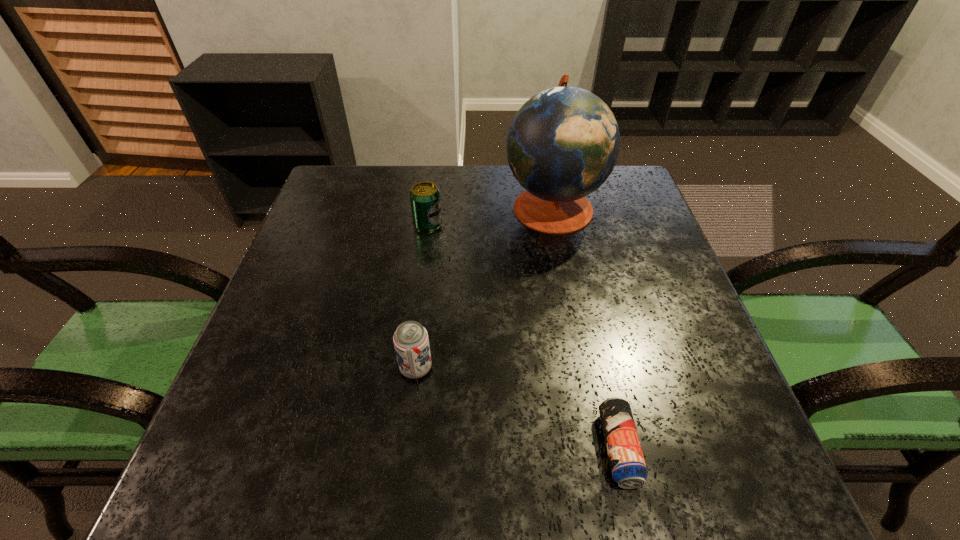
At what (x,y) coordinates should I click in order to perform the action: click on the tallest object. Please return your answer as a coordinate pair (x, y). Looking at the image, I should click on (563, 143).

Image resolution: width=960 pixels, height=540 pixels. Find the location of `the farthest beer can`. the farthest beer can is located at coordinates (425, 200).

At what (x,y) coordinates should I click in order to perform the action: click on the second nearest beer can. Please return your answer as a coordinate pair (x, y). The height and width of the screenshot is (540, 960). Looking at the image, I should click on (411, 342).

Locate an element on the screen. the shortest object is located at coordinates (627, 463).

Identify the location of the shortest beer can. This screenshot has height=540, width=960. (627, 463).

Image resolution: width=960 pixels, height=540 pixels. In order to click on vacant space located 0.360m with the Americas facing the viewer on the tallest object in this screenshot , I will do 370,206.

What are the coordinates of `free space located with the Americas facing the viewer on the tallest object` in the screenshot? It's located at (481, 206).

In order to click on free spot located 0.290m with the Americas facing the viewer on the tallest object in this screenshot , I will do `click(396, 206)`.

Identify the location of vacant region located on the front of the farthest beer can. This screenshot has height=540, width=960. (417, 310).

Where is `vacant space situated on the back of the second nearest object`? This screenshot has height=540, width=960. vacant space situated on the back of the second nearest object is located at coordinates (431, 240).